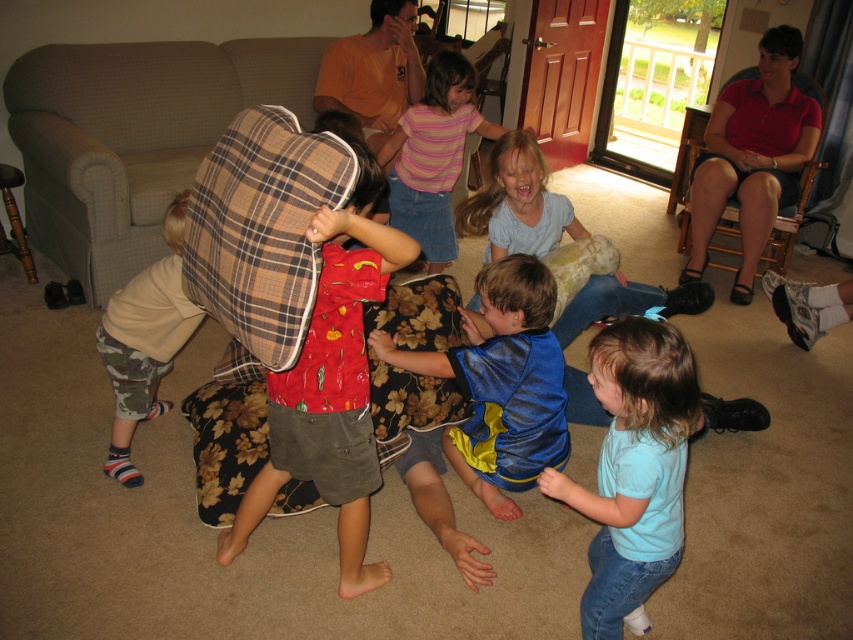
Can you confirm if matte plaid pillow at center is positioned to the right of dark red fabric chair at upper right?

Incorrect, matte plaid pillow at center is not on the right side of dark red fabric chair at upper right.

In the scene shown: Measure the distance from matte plaid pillow at center to dark red fabric chair at upper right.

matte plaid pillow at center and dark red fabric chair at upper right are 9.51 feet apart.

Which is in front, point (343, 266) or point (689, 209)?

Point (343, 266) is in front.

You are a GUI agent. You are given a task and a screenshot of the screen. Output one action in this format:
    pyautogui.click(x=<x>, y=<y>)
    Task: Click on the matte plaid pillow at center
    
    Given the screenshot: What is the action you would take?
    pyautogui.click(x=331, y=388)

Is point (563, 404) closer to camera compared to point (722, 266)?

Yes, it is in front of point (722, 266).

What do you see at coordinates (502, 384) in the screenshot?
I see `blue shiny shirt at center` at bounding box center [502, 384].

Which is behind, point (508, 305) or point (675, 182)?

Point (675, 182)

The height and width of the screenshot is (640, 853). I want to click on blue shiny shirt at center, so click(x=502, y=384).

Does matte plaid pillow at center have a greater height compared to blue shiny shirt at center?

Indeed, matte plaid pillow at center has a greater height compared to blue shiny shirt at center.

The width and height of the screenshot is (853, 640). What do you see at coordinates (331, 388) in the screenshot? I see `matte plaid pillow at center` at bounding box center [331, 388].

At what (x,y) coordinates should I click in order to perform the action: click on matte plaid pillow at center. Please return your answer as a coordinate pair (x, y). Image resolution: width=853 pixels, height=640 pixels. Looking at the image, I should click on (331, 388).